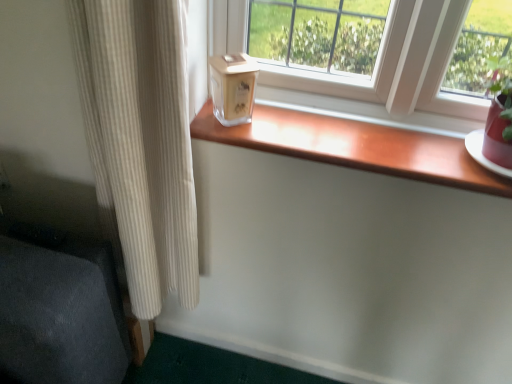
Question: Looking at the image, does beige ribbed curtain at left seem bigger or smaller compared to clear glass candle at center?

Choices:
 (A) big
 (B) small

Answer: (A)

Question: Considering the positions of point (145, 233) and point (226, 109), is point (145, 233) closer or farther from the camera than point (226, 109)?

Choices:
 (A) farther
 (B) closer

Answer: (A)

Question: Which of these objects is positioned farthest from the beige ribbed curtain at left?

Choices:
 (A) clear glass candle at center
 (B) wooden at center

Answer: (B)

Question: Which is nearer to the beige ribbed curtain at left?

Choices:
 (A) clear glass candle at center
 (B) wooden at center

Answer: (A)